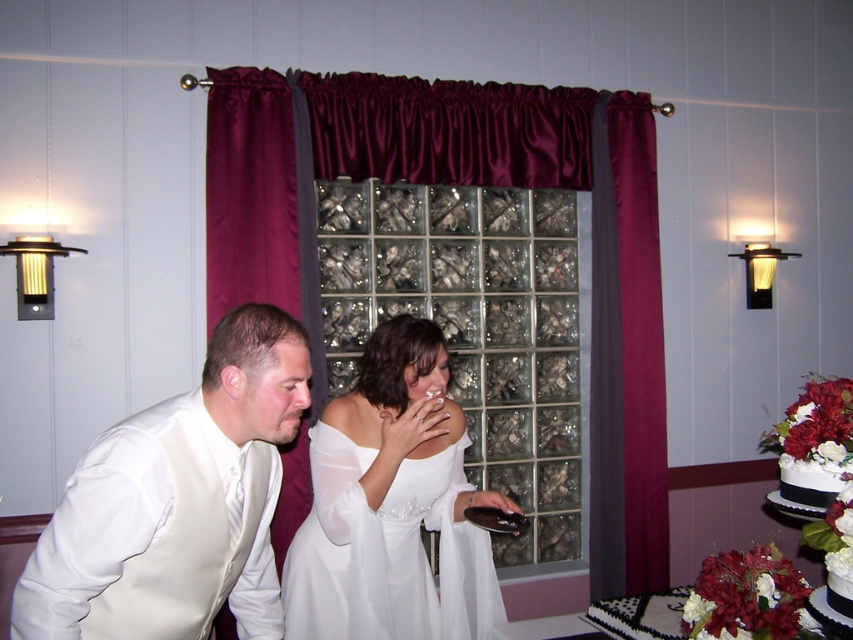
Looking at this image, based on the scene description, which object is shorter between the white satin vest at left and the white satin dress at center?

The white satin vest at left is shorter than the white satin dress at center.

In the wedding scene, you notice the maroon satin curtain at center and the white satin dress at center. Which object is wider?

The maroon satin curtain at center is wider than the white satin dress at center.

In the wedding scene, you notice the maroon satin curtain at center and the white satin vest at left. Which of these two items is larger in size?

The maroon satin curtain at center is bigger than the white satin vest at left.